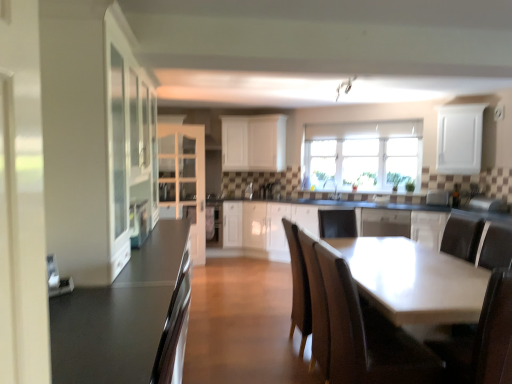
Question: Is satin silver toaster at center, arranged as the second appliance when viewed from the left, not inside smooth dark gray countertop at left?

Choices:
 (A) yes
 (B) no

Answer: (A)

Question: Is satin silver toaster at center, which is counted as the 3th appliance, starting from the bottom, positioned with its back to smooth dark gray countertop at left?

Choices:
 (A) yes
 (B) no

Answer: (B)

Question: Is satin silver toaster at center, arranged as the second appliance when viewed from the left, at the left side of smooth dark gray countertop at left?

Choices:
 (A) no
 (B) yes

Answer: (A)

Question: Can you confirm if satin silver toaster at center, placed as the 2th appliance when sorted from right to left, is taller than smooth dark gray countertop at left?

Choices:
 (A) yes
 (B) no

Answer: (B)

Question: Can you confirm if satin silver toaster at center, marked as the first appliance in a back-to-front arrangement, is bigger than smooth dark gray countertop at left?

Choices:
 (A) yes
 (B) no

Answer: (B)

Question: Visually, is white glossy dishwasher at center positioned to the left or to the right of white glossy sink at center?

Choices:
 (A) left
 (B) right

Answer: (B)

Question: Is white glossy dishwasher at center wider or thinner than white glossy sink at center?

Choices:
 (A) thin
 (B) wide

Answer: (B)

Question: Considering the positions of point pos(386,226) and point pos(338,196), is point pos(386,226) closer or farther from the camera than point pos(338,196)?

Choices:
 (A) closer
 (B) farther

Answer: (A)

Question: In the image, is white glossy dishwasher at center positioned in front of or behind white glossy sink at center?

Choices:
 (A) front
 (B) behind

Answer: (A)

Question: From a real-world perspective, is white glossy cabinet at center, positioned as the 3th cabinetry in front-to-back order, physically located above or below white matte cabinet at upper center, the 2th cabinetry when ordered from back to front?

Choices:
 (A) below
 (B) above

Answer: (A)

Question: From the image's perspective, is white glossy cabinet at center, the second cabinetry from the right, located above or below white matte cabinet at upper center, the 2th cabinetry when ordered from back to front?

Choices:
 (A) below
 (B) above

Answer: (A)

Question: Based on their sizes in the image, would you say white glossy cabinet at center, placed as the 5th cabinetry when sorted from left to right, is bigger or smaller than white matte cabinet at upper center, the 2th cabinetry when ordered from back to front?

Choices:
 (A) big
 (B) small

Answer: (B)

Question: Is point (445, 213) closer or farther from the camera than point (280, 163)?

Choices:
 (A) farther
 (B) closer

Answer: (B)

Question: In terms of size, does wooden chair at lower right appear bigger or smaller than clear glass windows at upper center?

Choices:
 (A) big
 (B) small

Answer: (A)

Question: From a real-world perspective, relative to clear glass windows at upper center, is wooden chair at lower right vertically above or below?

Choices:
 (A) below
 (B) above

Answer: (A)